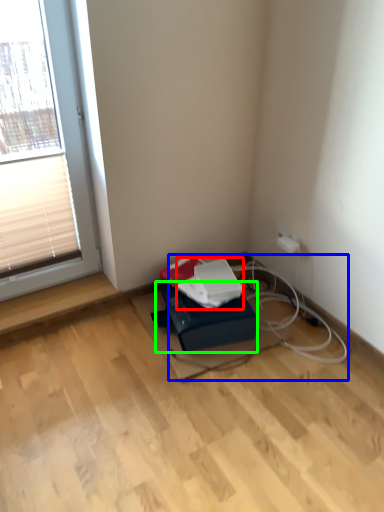
Question: Estimate the real-world distances between objects in this image. Which object is farther from paperback book (highlighted by a red box), cable (highlighted by a blue box) or cardboard box (highlighted by a green box)?

Choices:
 (A) cable
 (B) cardboard box

Answer: (A)